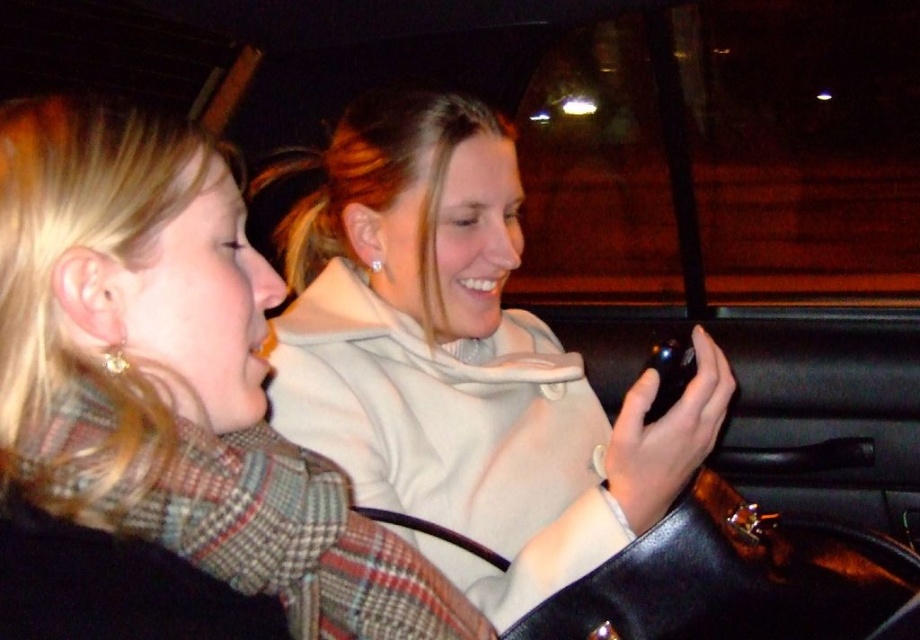
Question: Can you confirm if plaid wool scarf at center is smaller than white matte hoodie at center?

Choices:
 (A) no
 (B) yes

Answer: (B)

Question: Can you confirm if plaid wool scarf at center is positioned below white matte hoodie at center?

Choices:
 (A) no
 (B) yes

Answer: (B)

Question: Among these objects, which one is farthest from the camera?

Choices:
 (A) plaid wool scarf at center
 (B) white matte hoodie at center

Answer: (B)

Question: Which point is closer to the camera?

Choices:
 (A) (642, 502)
 (B) (251, 444)

Answer: (B)

Question: Which object is closer to the camera taking this photo?

Choices:
 (A) white matte hoodie at center
 (B) plaid wool scarf at center

Answer: (B)

Question: Is the position of plaid wool scarf at center more distant than that of white matte hoodie at center?

Choices:
 (A) yes
 (B) no

Answer: (B)